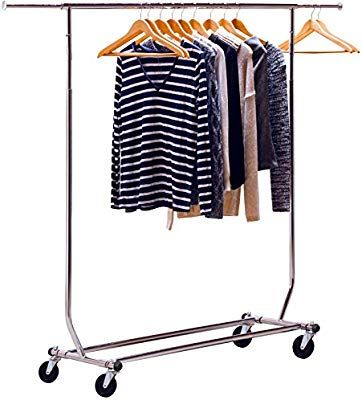
This screenshot has width=362, height=400. In order to click on wheels on clothes cart in this screenshot , I will do `click(55, 375)`, `click(110, 390)`, `click(308, 353)`, `click(240, 343)`.